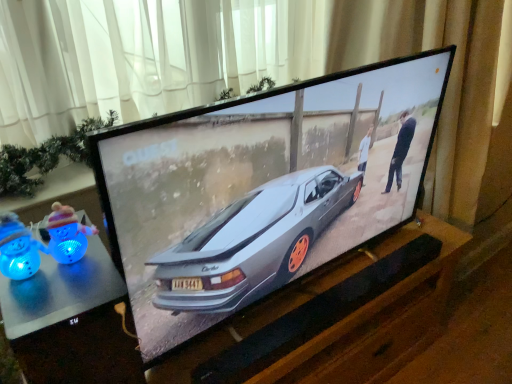
Where is `vacant area that lies to the right of blue plastic toy at lower left, marked as the 1th toy in a left-to-right arrangement`? vacant area that lies to the right of blue plastic toy at lower left, marked as the 1th toy in a left-to-right arrangement is located at coordinates (84, 290).